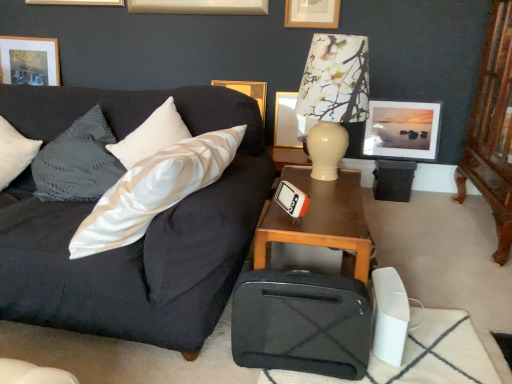
This screenshot has width=512, height=384. I want to click on blank space situated above matte gold picture frame at upper left, positioned as the 1th picture frame in left-to-right order (from a real-world perspective), so click(24, 36).